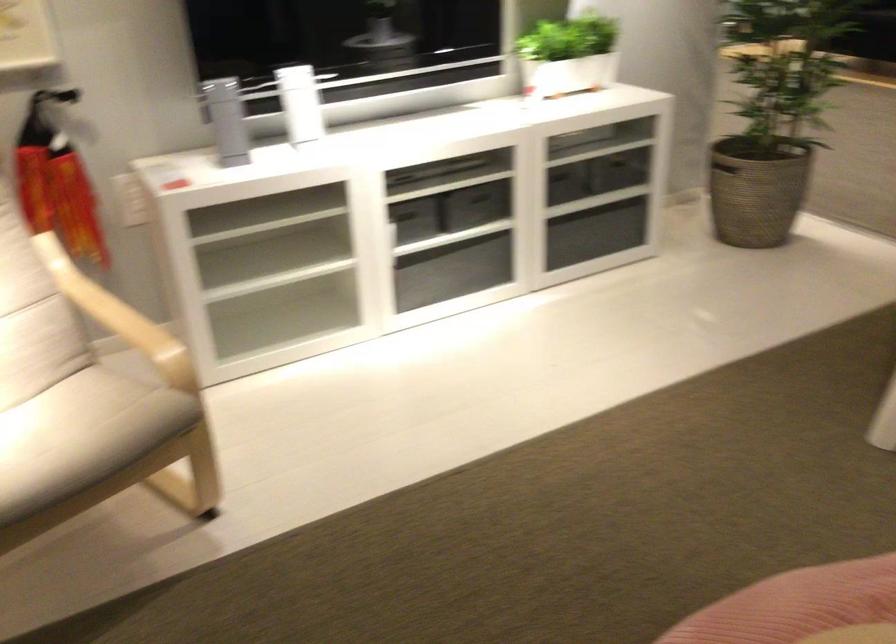
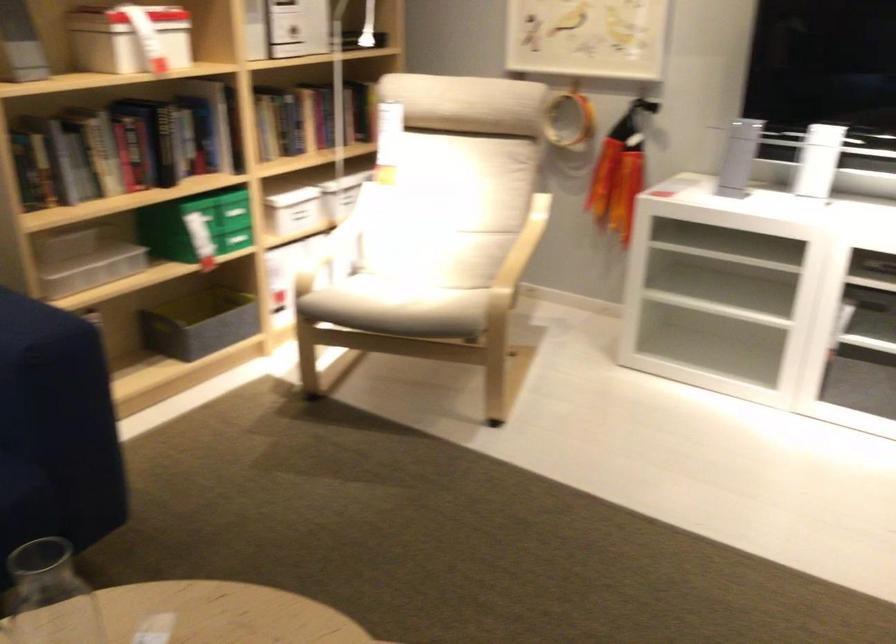
Find the pixel in the second image that matches point (76, 275) in the first image.

(536, 223)